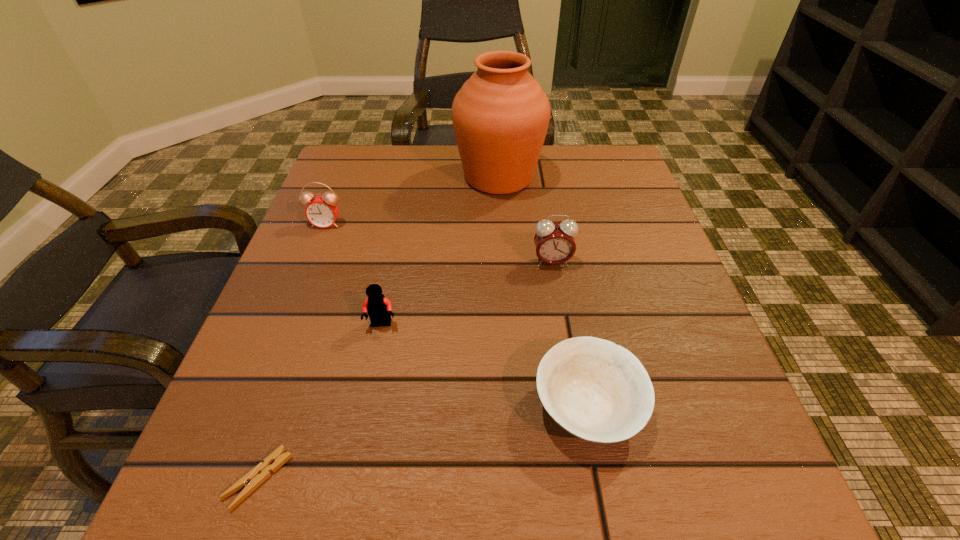
Find the location of a particular element. The image size is (960, 540). vacant space situated on the left of the urn is located at coordinates (372, 177).

This screenshot has height=540, width=960. What are the coordinates of `free space located on the clock face of the right alarm clock` in the screenshot? It's located at (564, 336).

Where is `blank space located 0.250m on the clock face of the left alarm clock`? blank space located 0.250m on the clock face of the left alarm clock is located at coordinates (287, 321).

The image size is (960, 540). In order to click on vacant space situated 0.210m on the front-facing side of the fourth farthest object in this screenshot , I will do `click(355, 457)`.

Find the location of `vacant region located 0.070m on the right of the fifth tallest object`. vacant region located 0.070m on the right of the fifth tallest object is located at coordinates (690, 408).

Locate an element on the screen. vacant space positioned 0.250m on the right of the shortest object is located at coordinates (479, 478).

The image size is (960, 540). What are the coordinates of `object situated at the far edge` in the screenshot? It's located at pyautogui.click(x=500, y=115).

Find the location of a particular element. bowl located at the near edge is located at coordinates pyautogui.click(x=596, y=390).

The image size is (960, 540). What are the coordinates of `clothespin that is at the near edge` in the screenshot? It's located at (253, 479).

Locate an element on the screen. Image resolution: width=960 pixels, height=540 pixels. alarm clock that is at the left edge is located at coordinates (322, 211).